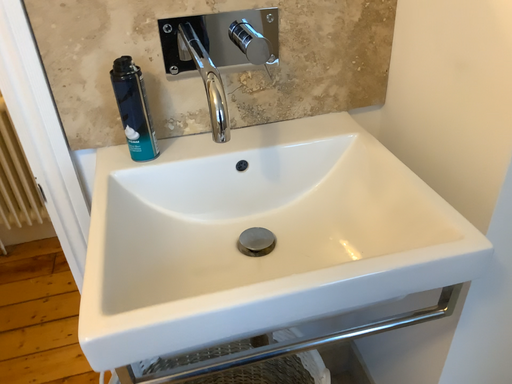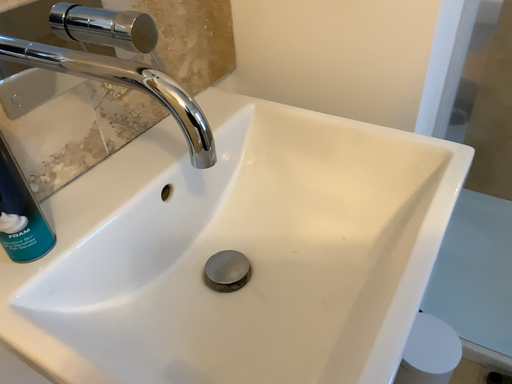
Question: Which way did the camera rotate in the video?

Choices:
 (A) rotated right
 (B) rotated left

Answer: (A)